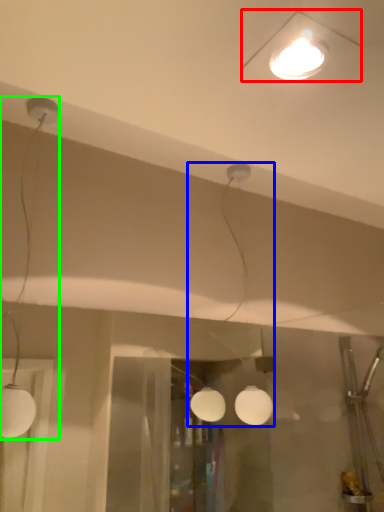
Question: Based on their relative distances, which object is nearer to lamp (highlighted by a red box)? Choose from lamp (highlighted by a blue box) and lamp (highlighted by a green box).

Choices:
 (A) lamp
 (B) lamp

Answer: (A)